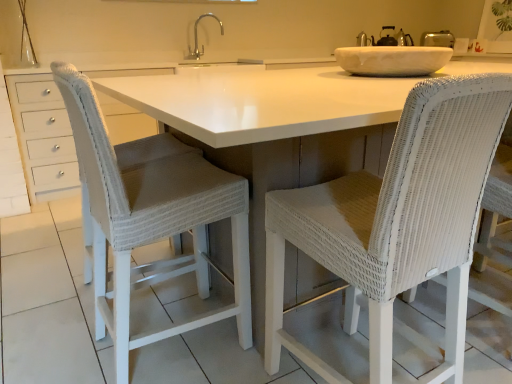
Identify the location of silver metallic faucet at upper center. The height and width of the screenshot is (384, 512). (x=197, y=37).

Locate an element on the screen. Image resolution: width=512 pixels, height=384 pixels. tap on the left of white wicker chair at center, which is the 2th chair from right to left is located at coordinates (197, 37).

Is silver metallic faucet at upper center not inside white wicker chair at center, which is the 2th chair from right to left?

silver metallic faucet at upper center lies outside white wicker chair at center, which is the 2th chair from right to left,'s area.

Is the depth of silver metallic faucet at upper center greater than that of white wicker chair at center, placed as the 1th chair when sorted from left to right?

Yes, silver metallic faucet at upper center is further from the camera.

Can you see silver metallic faucet at upper center touching white wicker chair at center, which is the 2th chair from right to left?

No.

Which of these two, white wicker chair at center, placed as the 2th chair when sorted from left to right, or white wicker chair at center, which is the 2th chair from right to left, is smaller?

With smaller size is white wicker chair at center, which is the 2th chair from right to left.

From the image's perspective, relative to white wicker chair at center, which is the 2th chair from right to left, is white wicker chair at center, the first chair in the right-to-left sequence, above or below?

white wicker chair at center, the first chair in the right-to-left sequence, is below white wicker chair at center, which is the 2th chair from right to left.

This screenshot has width=512, height=384. Find the location of `chair above the white wicker chair at center, placed as the 2th chair when sorted from left to right (from the image's perspective)`. chair above the white wicker chair at center, placed as the 2th chair when sorted from left to right (from the image's perspective) is located at coordinates (149, 216).

Do you think white wicker chair at center, placed as the 2th chair when sorted from left to right, is within white wicker chair at center, placed as the 1th chair when sorted from left to right, or outside of it?

white wicker chair at center, placed as the 2th chair when sorted from left to right, is not enclosed by white wicker chair at center, placed as the 1th chair when sorted from left to right.

From a real-world perspective, who is located lower, white wicker chair at center, which is the 2th chair from right to left, or white wicker chair at center, the first chair in the right-to-left sequence?

In real-world perspective, white wicker chair at center, the first chair in the right-to-left sequence, is lower.

Which of these two, white wicker chair at center, which is the 2th chair from right to left, or white wicker chair at center, the first chair in the right-to-left sequence, stands taller?

With more height is white wicker chair at center, which is the 2th chair from right to left.

Is white wicker chair at center, placed as the 1th chair when sorted from left to right, spatially inside white wicker chair at center, placed as the 2th chair when sorted from left to right, or outside of it?

white wicker chair at center, placed as the 1th chair when sorted from left to right, is located beyond the bounds of white wicker chair at center, placed as the 2th chair when sorted from left to right.

Does white wicker chair at center, placed as the 1th chair when sorted from left to right, lie in front of white wicker chair at center, the first chair in the right-to-left sequence?

No, the depth of white wicker chair at center, placed as the 1th chair when sorted from left to right, is greater than that of white wicker chair at center, the first chair in the right-to-left sequence.

Is point (469, 112) closer or farther from the camera than point (222, 30)?

Point (469, 112) is positioned closer to the camera compared to point (222, 30).

Based on the photo, is white wicker chair at center, placed as the 2th chair when sorted from left to right, completely or partially outside of silver metallic faucet at upper center?

Absolutely, white wicker chair at center, placed as the 2th chair when sorted from left to right, is external to silver metallic faucet at upper center.

Considering their positions, is white wicker chair at center, placed as the 2th chair when sorted from left to right, located in front of or behind silver metallic faucet at upper center?

In the image, white wicker chair at center, placed as the 2th chair when sorted from left to right, appears in front of silver metallic faucet at upper center.

Looking at the image, does white wicker chair at center, the first chair in the right-to-left sequence, seem bigger or smaller compared to silver metallic faucet at upper center?

Considering their sizes, white wicker chair at center, the first chair in the right-to-left sequence, takes up more space than silver metallic faucet at upper center.

Does point (199, 54) lie in front of point (351, 243)?

No.

Locate an element on the screen. The height and width of the screenshot is (384, 512). chair that is the 2nd object located below the silver metallic faucet at upper center (from the image's perspective) is located at coordinates (396, 223).

How much distance is there between silver metallic faucet at upper center and white wicker chair at center, placed as the 2th chair when sorted from left to right?

A distance of 3.17 meters exists between silver metallic faucet at upper center and white wicker chair at center, placed as the 2th chair when sorted from left to right.

From a real-world perspective, which object stands above the other?

silver metallic faucet at upper center is physically above.

Is white wicker chair at center, placed as the 1th chair when sorted from left to right, facing towards silver metallic faucet at upper center?

No, white wicker chair at center, placed as the 1th chair when sorted from left to right, is not turned towards silver metallic faucet at upper center.

Is point (247, 323) farther from viewer compared to point (202, 45)?

No.

Does white wicker chair at center, placed as the 1th chair when sorted from left to right, lie in front of silver metallic faucet at upper center?

That is True.

In order to click on tap above the white wicker chair at center, placed as the 1th chair when sorted from left to right (from the image's perspective) in this screenshot , I will do `click(197, 37)`.

Where is `chair above the white wicker chair at center, the first chair in the right-to-left sequence (from a real-world perspective)`? The width and height of the screenshot is (512, 384). chair above the white wicker chair at center, the first chair in the right-to-left sequence (from a real-world perspective) is located at coordinates (149, 216).

Estimate the real-world distances between objects in this image. Which object is further from white wicker chair at center, which is the 2th chair from right to left, silver metallic faucet at upper center or white wicker chair at center, placed as the 2th chair when sorted from left to right?

silver metallic faucet at upper center.

When comparing their distances from white wicker chair at center, placed as the 2th chair when sorted from left to right, does silver metallic faucet at upper center or white wicker chair at center, which is the 2th chair from right to left, seem closer?

Among the two, white wicker chair at center, which is the 2th chair from right to left, is located nearer to white wicker chair at center, placed as the 2th chair when sorted from left to right.

Considering their positions, is white wicker chair at center, which is the 2th chair from right to left, positioned further to silver metallic faucet at upper center than white wicker chair at center, the first chair in the right-to-left sequence?

white wicker chair at center, the first chair in the right-to-left sequence, is positioned further to the anchor silver metallic faucet at upper center.

Estimate the real-world distances between objects in this image. Which object is closer to white wicker chair at center, placed as the 2th chair when sorted from left to right, white wicker chair at center, placed as the 1th chair when sorted from left to right, or silver metallic faucet at upper center?

white wicker chair at center, placed as the 1th chair when sorted from left to right, is closer to white wicker chair at center, placed as the 2th chair when sorted from left to right.

Considering their positions, is white wicker chair at center, placed as the 2th chair when sorted from left to right, positioned closer to white wicker chair at center, placed as the 1th chair when sorted from left to right, than silver metallic faucet at upper center?

The object closer to white wicker chair at center, placed as the 1th chair when sorted from left to right, is white wicker chair at center, placed as the 2th chair when sorted from left to right.

From the image, which object appears to be farther from silver metallic faucet at upper center, white wicker chair at center, placed as the 2th chair when sorted from left to right, or white wicker chair at center, placed as the 1th chair when sorted from left to right?

white wicker chair at center, placed as the 2th chair when sorted from left to right, is positioned further to the anchor silver metallic faucet at upper center.

The image size is (512, 384). Identify the location of chair located between white wicker chair at center, the first chair in the right-to-left sequence, and silver metallic faucet at upper center in the depth direction. (149, 216).